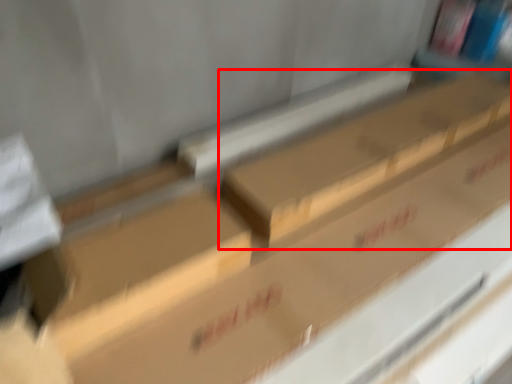
Question: From the image, what is the correct spatial relationship of box (annotated by the red box) in relation to block?

Choices:
 (A) left
 (B) right

Answer: (B)